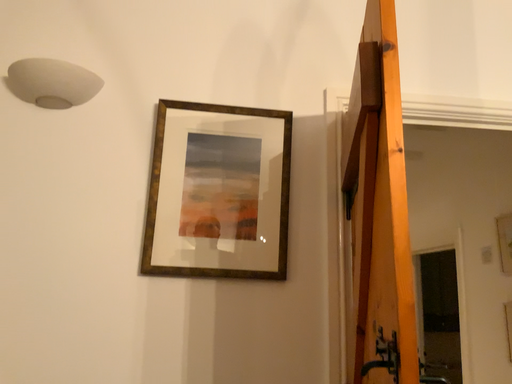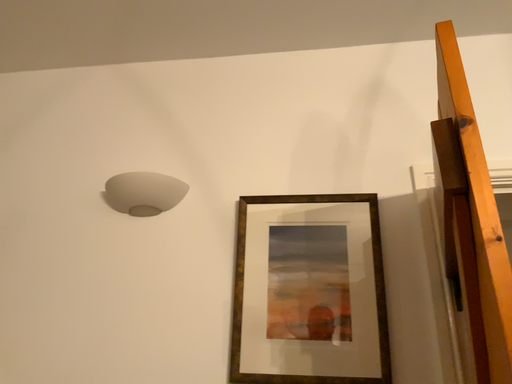
Question: How did the camera likely rotate when shooting the video?

Choices:
 (A) rotated left
 (B) rotated right

Answer: (A)